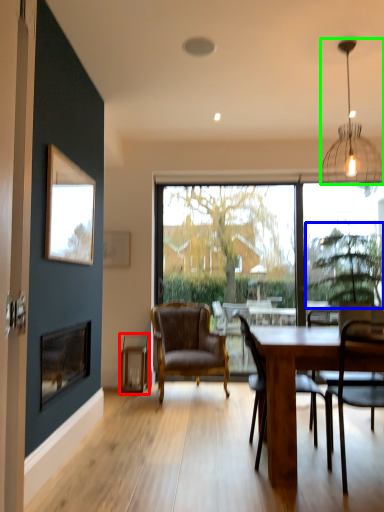
Question: Which is nearer to the plank (highlighted by a red box)? tree (highlighted by a blue box) or lamp (highlighted by a green box).

Choices:
 (A) tree
 (B) lamp

Answer: (A)